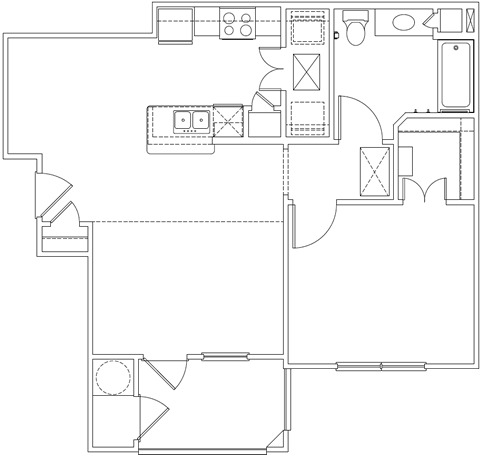
This screenshot has height=455, width=483. I want to click on sink, so click(x=403, y=21).